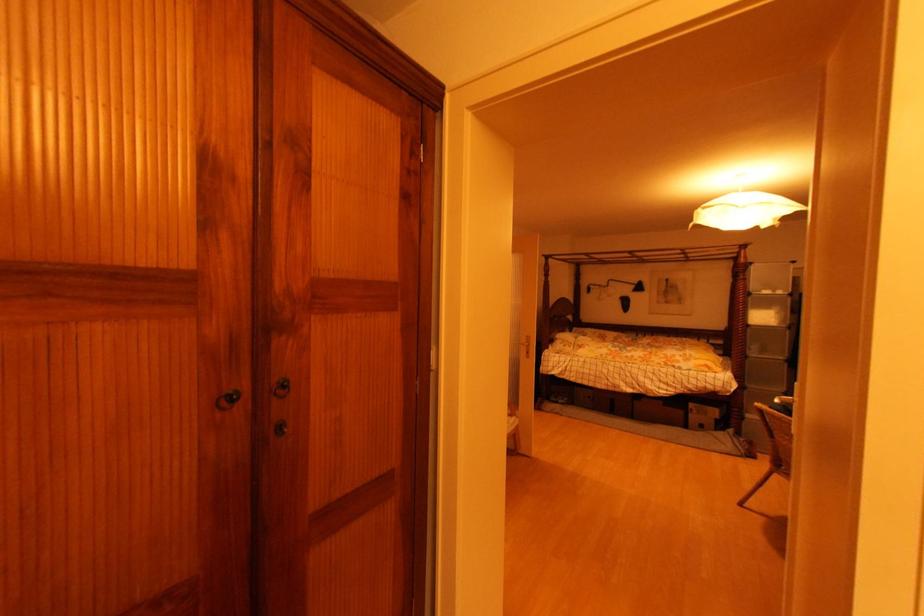
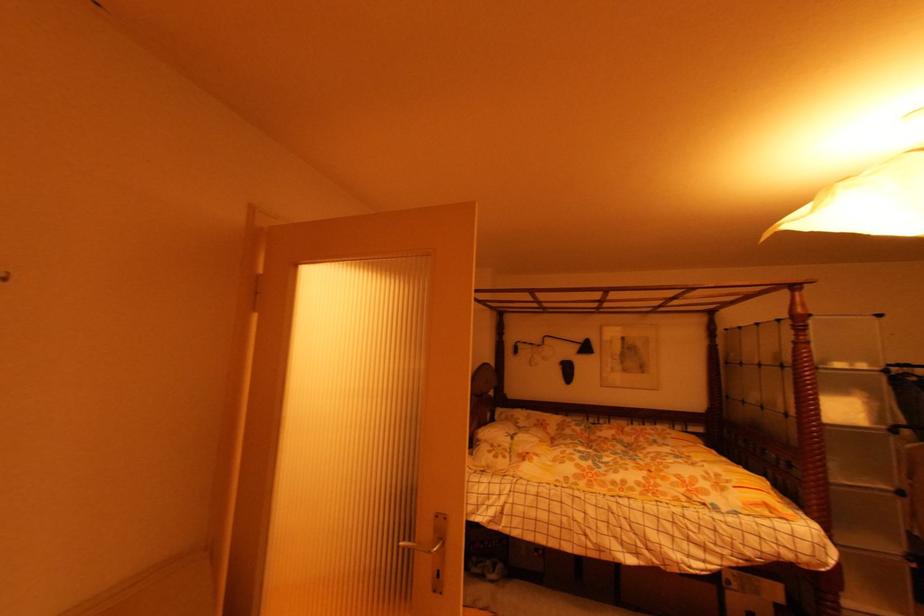
Question: Which direction would the cameraman need to move to produce the second image? Reply with the corresponding letter.

Choices:
 (A) Left
 (B) Right
 (C) Forward
 (D) Backward

Answer: (C)